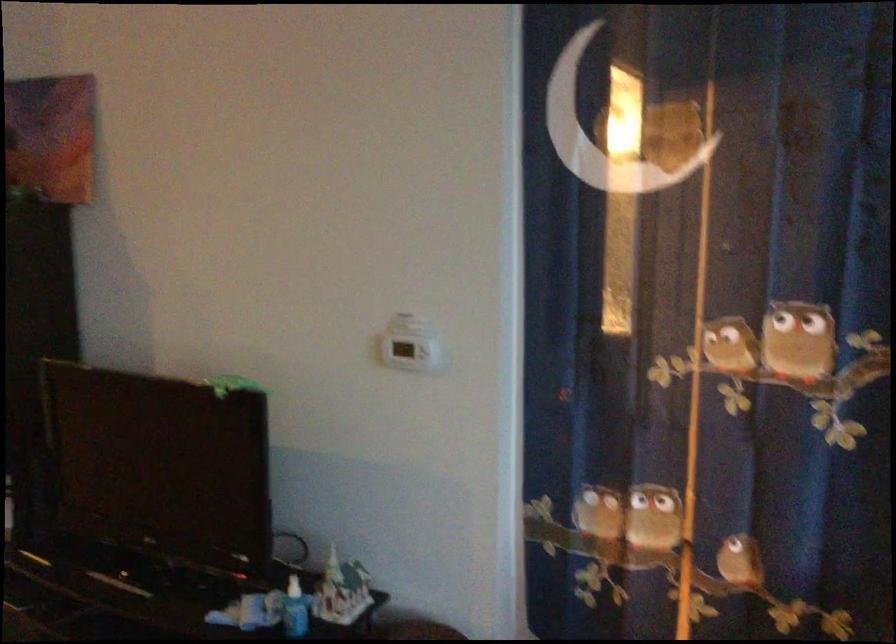
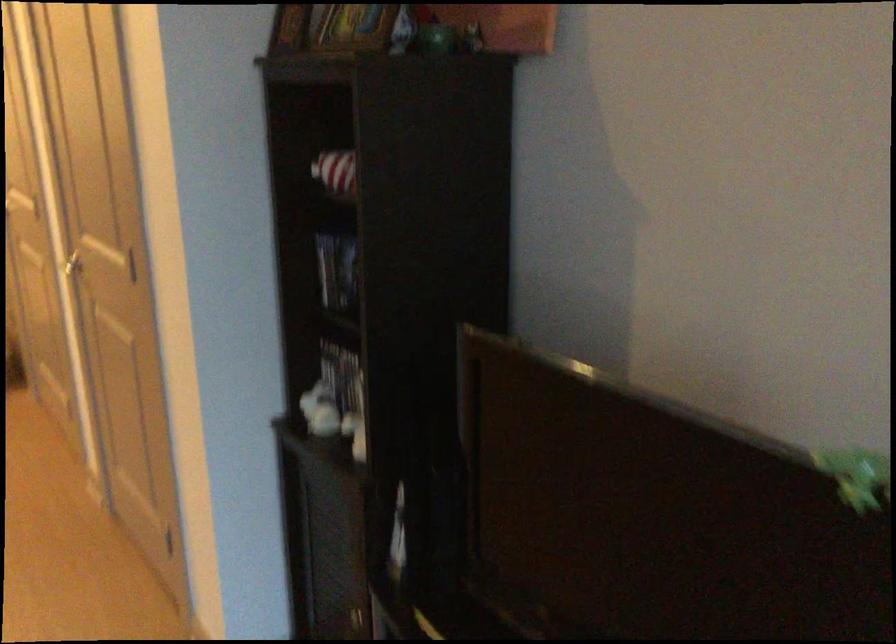
Find the pixel in the second image that matches (211,384) in the first image.

(857, 476)